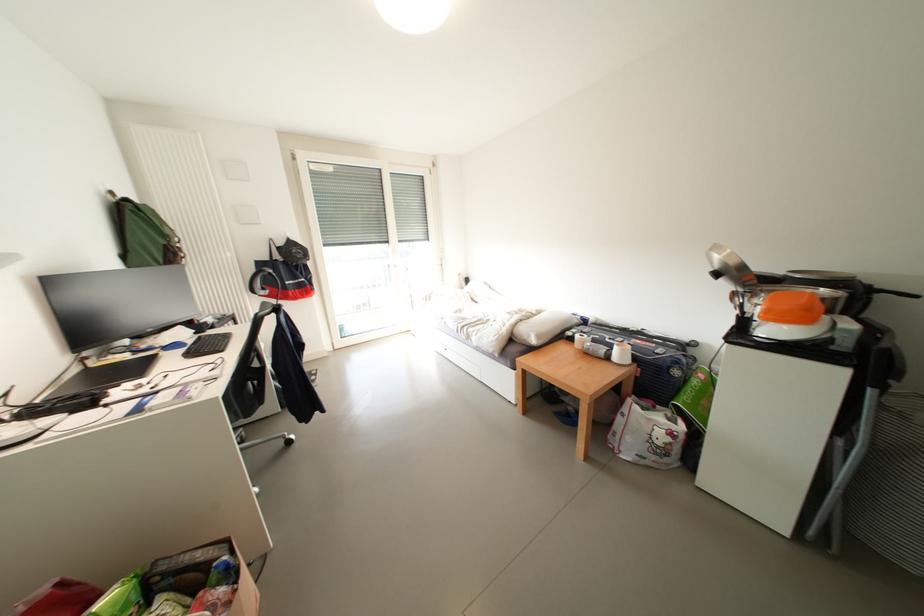
Where is `green backpack`? The height and width of the screenshot is (616, 924). green backpack is located at coordinates (142, 233).